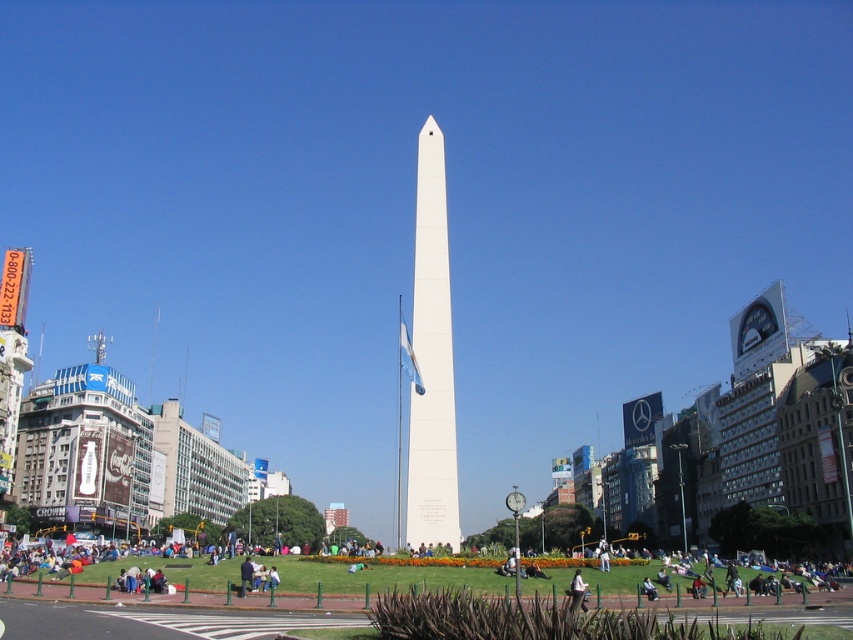
Question: Can you confirm if green grass at lower center is positioned above light brown leather jacket at lower center?

Choices:
 (A) yes
 (B) no

Answer: (B)

Question: Does white polished stone obelisk at center come behind green grass at lower center?

Choices:
 (A) yes
 (B) no

Answer: (A)

Question: Which of the following is the farthest from the observer?

Choices:
 (A) white polished stone obelisk at center
 (B) light brown leather jacket at lower center
 (C) green grass at lower center

Answer: (A)

Question: Which is farther from the white polished stone obelisk at center?

Choices:
 (A) light brown leather jacket at lower center
 (B) green grass at lower center

Answer: (A)

Question: Which point appears farthest from the camera in this image?

Choices:
 (A) (575, 592)
 (B) (456, 467)

Answer: (B)

Question: Does white polished stone obelisk at center appear under light brown leather jacket at lower center?

Choices:
 (A) yes
 (B) no

Answer: (B)